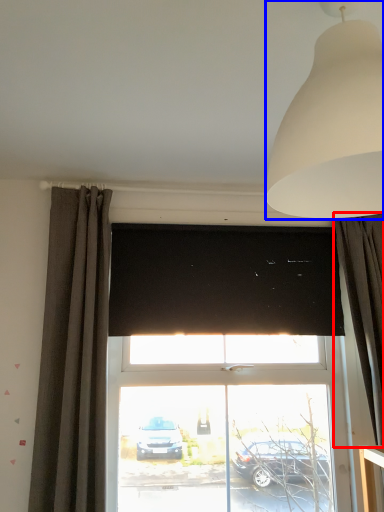
Question: Which of the following is the farthest to the observer, curtain (highlighted by a red box) or lamp (highlighted by a blue box)?

Choices:
 (A) curtain
 (B) lamp

Answer: (A)